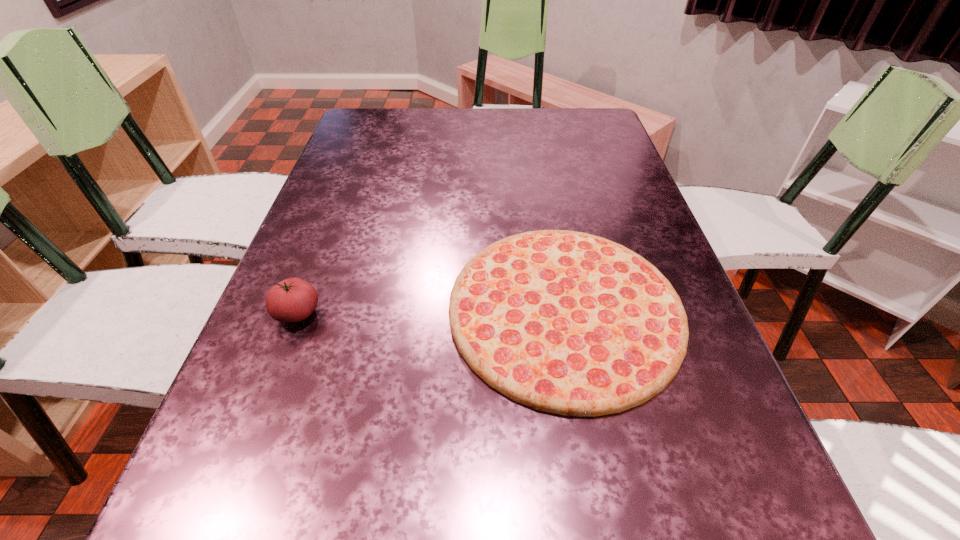
Image resolution: width=960 pixels, height=540 pixels. Identify the location of vacant space at the right edge. (613, 176).

I want to click on free spot at the far left corner of the desktop, so click(x=398, y=108).

In the image, there is a desktop. What are the coordinates of `free space at the far right corner` in the screenshot? It's located at (579, 117).

This screenshot has width=960, height=540. Find the location of `vacant space that satisfies the following two spatial constraints: 1. on the back side of the tomato; 2. on the left side of the pizza`. vacant space that satisfies the following two spatial constraints: 1. on the back side of the tomato; 2. on the left side of the pizza is located at coordinates (299, 310).